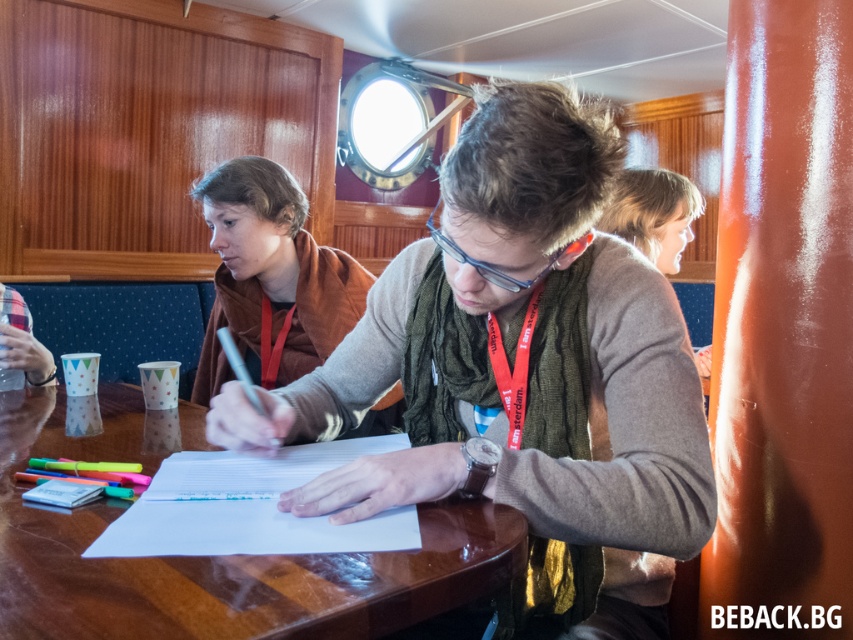
Question: Which object is positioned farthest from the green sweater at center?

Choices:
 (A) brown leather jacket at upper left
 (B) wooden table at center

Answer: (A)

Question: Does green sweater at center appear on the right side of brown leather jacket at upper left?

Choices:
 (A) yes
 (B) no

Answer: (A)

Question: Does wooden table at center appear under brown leather jacket at upper left?

Choices:
 (A) no
 (B) yes

Answer: (B)

Question: Which point is closer to the camera taking this photo?

Choices:
 (A) (222, 243)
 (B) (368, 499)
 (C) (383, 586)

Answer: (C)

Question: Is the position of green sweater at center less distant than that of brown leather jacket at upper left?

Choices:
 (A) no
 (B) yes

Answer: (B)

Question: Which of these objects is positioned closest to the green sweater at center?

Choices:
 (A) brown leather jacket at upper left
 (B) wooden table at center

Answer: (B)